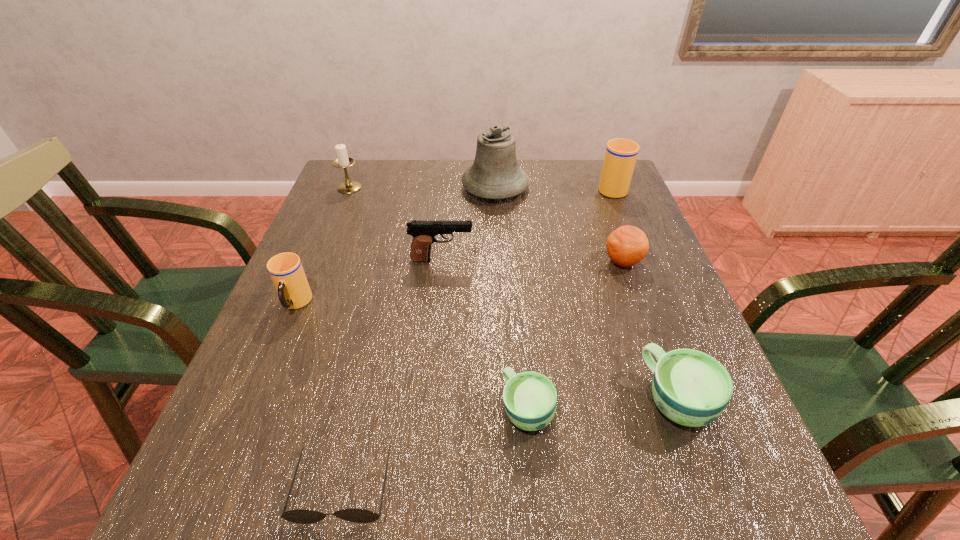
Select which cup is the second closest to the bigger beige cup. Please provide its 2D coordinates. Your answer should be formatted as a tuple, i.e. [(x, y)], where the tuple contains the x and y coordinates of a point satisfying the conditions above.

[(530, 398)]

Identify the location of the closest cup to the white candle holder. The height and width of the screenshot is (540, 960). (286, 271).

Locate an element on the screen. The width and height of the screenshot is (960, 540). vacant space that satisfies the following two spatial constraints: 1. at the barrel of the black pistol; 2. on the side of the left beige cup with the handle is located at coordinates (438, 304).

I want to click on vacant position in the image that satisfies the following two spatial constraints: 1. on the front side of the tallest object; 2. on the right side of the second shortest object, so click(x=506, y=409).

In order to click on free space in the image that satisfies the following two spatial constraints: 1. at the barrel of the black pistol; 2. on the right side of the smaller blue cup in this screenshot , I will do `click(427, 409)`.

In order to click on vacant area in the image that satisfies the following two spatial constraints: 1. on the front side of the second cup from left to right; 2. on the left side of the white candle holder in this screenshot , I will do `click(259, 409)`.

Locate an element on the screen. This screenshot has height=540, width=960. free space that satisfies the following two spatial constraints: 1. on the side of the third shortest cup with the handle; 2. on the right side of the eighth tallest object is located at coordinates (252, 409).

Find the location of a particular element. The width and height of the screenshot is (960, 540). vacant area that satisfies the following two spatial constraints: 1. at the barrel of the black pistol; 2. on the back side of the right blue cup is located at coordinates (428, 399).